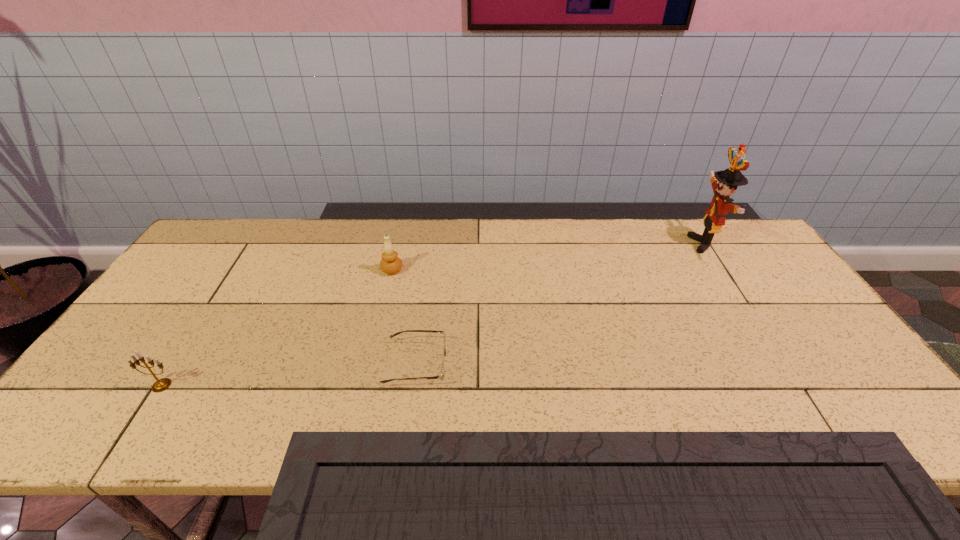
Locate an element on the screen. nutcracker is located at coordinates (724, 183).

I want to click on the tallest object, so click(x=724, y=183).

Where is `the farther candelabrum`? The image size is (960, 540). the farther candelabrum is located at coordinates (390, 264).

At what (x,y) coordinates should I click in order to perform the action: click on the right candelabrum. Please return your answer as a coordinate pair (x, y). Looking at the image, I should click on (390, 264).

Identify the location of the leftmost object. tap(160, 385).

At what (x,y) coordinates should I click in order to perform the action: click on the left candelabrum. Please return your answer as a coordinate pair (x, y). The height and width of the screenshot is (540, 960). Looking at the image, I should click on (160, 385).

The height and width of the screenshot is (540, 960). In order to click on spectacles in this screenshot , I will do `click(441, 376)`.

The height and width of the screenshot is (540, 960). Find the location of `the shortest object`. the shortest object is located at coordinates point(441,376).

Image resolution: width=960 pixels, height=540 pixels. I want to click on vacant area situated on the front-facing side of the rightmost object, so click(x=667, y=244).

Find the location of a particular element. blank space located on the front-facing side of the rightmost object is located at coordinates (600, 244).